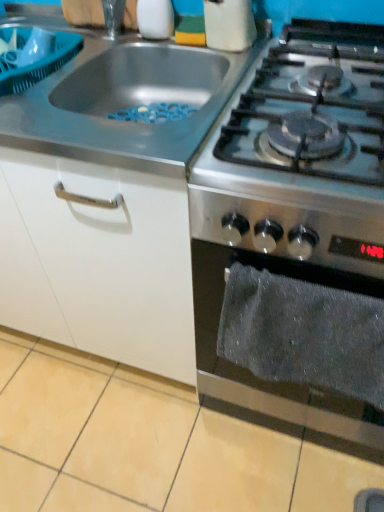
This screenshot has height=512, width=384. What do you see at coordinates (126, 102) in the screenshot?
I see `stainless steel gas stove at upper right, the 1th gas stove positioned from the left` at bounding box center [126, 102].

How much space does stainless steel gas stove at right, which is counted as the second gas stove, starting from the left, occupy horizontally?

65.38 centimeters.

Measure the distance between white glossy salt shaker at upper center and camera.

white glossy salt shaker at upper center is 3.33 feet from camera.

Identify the location of stainless steel gas stove at upper right, which appears as the 2th gas stove when viewed from the right. pos(126,102).

Relative to gray fabric towel at lower right, is stainless steel gas stove at right, positioned as the first gas stove in right-to-left order, in front or behind?

Visually, stainless steel gas stove at right, positioned as the first gas stove in right-to-left order, is located behind gray fabric towel at lower right.

Based on the photo, considering the sizes of objects stainless steel gas stove at right, positioned as the first gas stove in right-to-left order, and gray fabric towel at lower right in the image provided, who is bigger, stainless steel gas stove at right, positioned as the first gas stove in right-to-left order, or gray fabric towel at lower right?

stainless steel gas stove at right, positioned as the first gas stove in right-to-left order.

Locate an element on the screen. The width and height of the screenshot is (384, 512). gas stove below the gray fabric towel at lower right (from a real-world perspective) is located at coordinates (295, 207).

Is white glossy salt shaker at upper center far from gray fabric towel at lower right?

No.

Locate an element on the screen. Image resolution: width=384 pixels, height=512 pixels. oven below the white glossy salt shaker at upper center (from the image's perspective) is located at coordinates (277, 382).

Can you confirm if white glossy salt shaker at upper center is positioned to the right of gray fabric towel at lower right?

Incorrect, white glossy salt shaker at upper center is not on the right side of gray fabric towel at lower right.

From a real-world perspective, is white glossy salt shaker at upper center physically located above or below gray fabric towel at lower right?

From a real-world perspective, white glossy salt shaker at upper center is physically above gray fabric towel at lower right.

Does stainless steel gas stove at right, positioned as the first gas stove in right-to-left order, touch white glossy salt shaker at upper center?

No, stainless steel gas stove at right, positioned as the first gas stove in right-to-left order, is not with white glossy salt shaker at upper center.

Who is more distant, stainless steel gas stove at right, which is counted as the second gas stove, starting from the left, or white glossy salt shaker at upper center?

white glossy salt shaker at upper center.

Between stainless steel gas stove at right, positioned as the first gas stove in right-to-left order, and white glossy salt shaker at upper center, which one has smaller size?

Smaller between the two is white glossy salt shaker at upper center.

Consider the image. Could you tell me if stainless steel gas stove at right, positioned as the first gas stove in right-to-left order, is facing white glossy salt shaker at upper center?

No, stainless steel gas stove at right, positioned as the first gas stove in right-to-left order, is not aimed at white glossy salt shaker at upper center.

Considering the sizes of objects white glossy salt shaker at upper center and stainless steel gas stove at right, which is counted as the second gas stove, starting from the left, in the image provided, who is wider, white glossy salt shaker at upper center or stainless steel gas stove at right, which is counted as the second gas stove, starting from the left,?

Wider between the two is stainless steel gas stove at right, which is counted as the second gas stove, starting from the left.

Does white glossy salt shaker at upper center have a larger size compared to stainless steel gas stove at right, positioned as the first gas stove in right-to-left order?

Incorrect, white glossy salt shaker at upper center is not larger than stainless steel gas stove at right, positioned as the first gas stove in right-to-left order.

Does point (147, 19) come farther from viewer compared to point (245, 116)?

Yes.

From the image's perspective, which is above, white glossy salt shaker at upper center or stainless steel gas stove at right, which is counted as the second gas stove, starting from the left?

white glossy salt shaker at upper center, from the image's perspective.

Can you confirm if white glossy salt shaker at upper center is taller than stainless steel gas stove at upper right, the 1th gas stove positioned from the left?

Yes.

Considering the sizes of white glossy salt shaker at upper center and stainless steel gas stove at upper right, the 1th gas stove positioned from the left, in the image, is white glossy salt shaker at upper center wider or thinner than stainless steel gas stove at upper right, the 1th gas stove positioned from the left,?

In the image, white glossy salt shaker at upper center appears to be more narrow than stainless steel gas stove at upper right, the 1th gas stove positioned from the left.

Based on their sizes in the image, would you say white glossy salt shaker at upper center is bigger or smaller than stainless steel gas stove at upper right, the 1th gas stove positioned from the left?

In the image, white glossy salt shaker at upper center appears to be smaller than stainless steel gas stove at upper right, the 1th gas stove positioned from the left.

Can you confirm if white glossy salt shaker at upper center is positioned to the left of stainless steel gas stove at upper right, which appears as the 2th gas stove when viewed from the right?

No.

Which object is positioned more to the left, stainless steel gas stove at right, positioned as the first gas stove in right-to-left order, or stainless steel gas stove at upper right, the 1th gas stove positioned from the left?

From the viewer's perspective, stainless steel gas stove at upper right, the 1th gas stove positioned from the left, appears more on the left side.

Is stainless steel gas stove at right, positioned as the first gas stove in right-to-left order, spatially inside stainless steel gas stove at upper right, the 1th gas stove positioned from the left, or outside of it?

stainless steel gas stove at right, positioned as the first gas stove in right-to-left order, is spatially situated outside stainless steel gas stove at upper right, the 1th gas stove positioned from the left.

Between stainless steel gas stove at right, which is counted as the second gas stove, starting from the left, and stainless steel gas stove at upper right, which appears as the 2th gas stove when viewed from the right, which one is positioned behind?

Positioned behind is stainless steel gas stove at upper right, which appears as the 2th gas stove when viewed from the right.

From the picture: Is stainless steel gas stove at right, which is counted as the second gas stove, starting from the left, oriented away from stainless steel gas stove at upper right, which appears as the 2th gas stove when viewed from the right?

That's not correct — stainless steel gas stove at right, which is counted as the second gas stove, starting from the left, is not looking away from stainless steel gas stove at upper right, which appears as the 2th gas stove when viewed from the right.

How many degrees apart are the facing directions of gray fabric towel at lower right and stainless steel gas stove at upper right, which appears as the 2th gas stove when viewed from the right?

The angular difference between gray fabric towel at lower right and stainless steel gas stove at upper right, which appears as the 2th gas stove when viewed from the right, is 0.943 degrees.

Is gray fabric towel at lower right positioned before stainless steel gas stove at upper right, the 1th gas stove positioned from the left?

Yes, gray fabric towel at lower right is closer to the viewer.

Based on their positions, is gray fabric towel at lower right located to the left or right of stainless steel gas stove at upper right, which appears as the 2th gas stove when viewed from the right?

gray fabric towel at lower right is to the right of stainless steel gas stove at upper right, which appears as the 2th gas stove when viewed from the right.

Based on the photo, is gray fabric towel at lower right positioned far away from stainless steel gas stove at upper right, the 1th gas stove positioned from the left?

No.

The width and height of the screenshot is (384, 512). In order to click on oven that appears below the stainless steel gas stove at right, positioned as the first gas stove in right-to-left order (from the image's perspective) in this screenshot , I will do `click(277, 382)`.

What are the coordinates of `oven that is on the right side of white glossy salt shaker at upper center` in the screenshot? It's located at (277, 382).

From the picture: Which object lies further to the anchor point gray fabric towel at lower right, stainless steel gas stove at upper right, the 1th gas stove positioned from the left, or white glossy salt shaker at upper center?

The object further to gray fabric towel at lower right is white glossy salt shaker at upper center.

Considering their positions, is stainless steel gas stove at right, which is counted as the second gas stove, starting from the left, positioned closer to white glossy salt shaker at upper center than stainless steel gas stove at upper right, which appears as the 2th gas stove when viewed from the right?

stainless steel gas stove at upper right, which appears as the 2th gas stove when viewed from the right, lies closer to white glossy salt shaker at upper center than the other object.

From the image, which object appears to be nearer to stainless steel gas stove at right, positioned as the first gas stove in right-to-left order, gray fabric towel at lower right or stainless steel gas stove at upper right, the 1th gas stove positioned from the left?

gray fabric towel at lower right is closer to stainless steel gas stove at right, positioned as the first gas stove in right-to-left order.

Looking at the image, which one is located further to stainless steel gas stove at right, positioned as the first gas stove in right-to-left order, white glossy salt shaker at upper center or stainless steel gas stove at upper right, the 1th gas stove positioned from the left?

Among the two, white glossy salt shaker at upper center is located further to stainless steel gas stove at right, positioned as the first gas stove in right-to-left order.

Which object lies nearer to the anchor point stainless steel gas stove at right, positioned as the first gas stove in right-to-left order, stainless steel gas stove at upper right, the 1th gas stove positioned from the left, or white glossy salt shaker at upper center?

stainless steel gas stove at upper right, the 1th gas stove positioned from the left, lies closer to stainless steel gas stove at right, positioned as the first gas stove in right-to-left order, than the other object.

Consider the image. Which object lies nearer to the anchor point stainless steel gas stove at upper right, the 1th gas stove positioned from the left, white glossy salt shaker at upper center or gray fabric towel at lower right?

The object closer to stainless steel gas stove at upper right, the 1th gas stove positioned from the left, is white glossy salt shaker at upper center.

Based on their spatial positions, is gray fabric towel at lower right or stainless steel gas stove at right, positioned as the first gas stove in right-to-left order, further from stainless steel gas stove at upper right, which appears as the 2th gas stove when viewed from the right?

gray fabric towel at lower right is further to stainless steel gas stove at upper right, which appears as the 2th gas stove when viewed from the right.

Considering their positions, is gray fabric towel at lower right positioned closer to stainless steel gas stove at upper right, which appears as the 2th gas stove when viewed from the right, than white glossy salt shaker at upper center?

white glossy salt shaker at upper center.

The height and width of the screenshot is (512, 384). In order to click on gas stove between white glossy salt shaker at upper center and stainless steel gas stove at right, positioned as the first gas stove in right-to-left order, from top to bottom in this screenshot , I will do `click(126, 102)`.

The width and height of the screenshot is (384, 512). I want to click on oven between stainless steel gas stove at upper right, the 1th gas stove positioned from the left, and stainless steel gas stove at right, which is counted as the second gas stove, starting from the left, so click(277, 382).